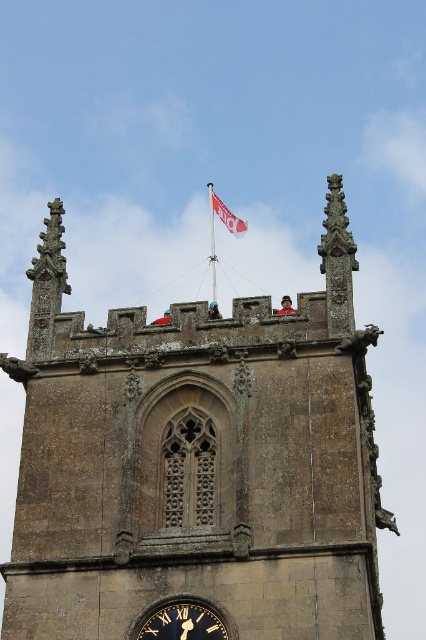
Which is more to the left, brown stone church at upper center or black metal clock at lower center?

black metal clock at lower center

Is point (218, 390) positioned behind point (161, 618)?

Yes.

Where is `brown stone church at upper center`? The width and height of the screenshot is (426, 640). brown stone church at upper center is located at coordinates (196, 461).

Is black metal clock at lower center shorter than white fabric flag at upper center?

Indeed, black metal clock at lower center has a lesser height compared to white fabric flag at upper center.

This screenshot has height=640, width=426. In order to click on black metal clock at lower center in this screenshot , I will do `click(183, 621)`.

Locate an element on the screen. This screenshot has width=426, height=640. black metal clock at lower center is located at coordinates (183, 621).

Which is above, brown stone church at upper center or white fabric flag at upper center?

Positioned higher is white fabric flag at upper center.

Does point (34, 545) come behind point (230, 230)?

No, (34, 545) is in front of (230, 230).

Measure the distance between brown stone church at upper center and camera.

They are 46.18 meters apart.

What are the coordinates of `brown stone church at upper center` in the screenshot? It's located at (196, 461).